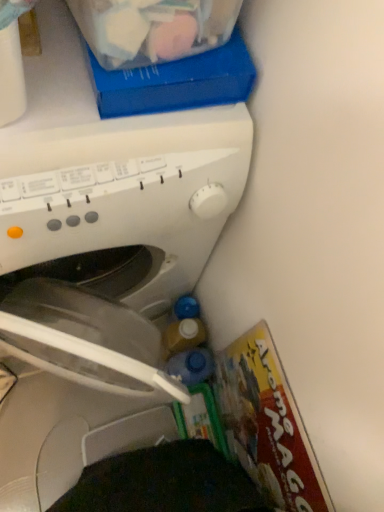
Describe the element at coordinates (115, 234) in the screenshot. I see `white plastic washing machine at center` at that location.

Where is `blue translucent bottle at lower right`? The image size is (384, 512). blue translucent bottle at lower right is located at coordinates (191, 366).

Find the location of a particular element. translucent plastic storage box at upper center is located at coordinates (175, 81).

Where is `washing machine on the left of blue translucent bottle at lower right`? washing machine on the left of blue translucent bottle at lower right is located at coordinates (115, 234).

Which of these two, blue translucent bottle at lower right or white plastic washing machine at center, is thinner?

Thinner between the two is blue translucent bottle at lower right.

Between blue translucent bottle at lower right and white plastic washing machine at center, which one appears on the right side from the viewer's perspective?

From the viewer's perspective, blue translucent bottle at lower right appears more on the right side.

Could white plastic washing machine at center be considered to be inside blue translucent bottle at lower right?

Actually, white plastic washing machine at center is outside blue translucent bottle at lower right.

Locate an element on the screen. washing machine below the translucent plastic storage box at upper center (from a real-world perspective) is located at coordinates (115, 234).

Does white plastic washing machine at center have a smaller size compared to translucent plastic storage box at upper center?

Incorrect, white plastic washing machine at center is not smaller in size than translucent plastic storage box at upper center.

From a real-world perspective, is white plastic washing machine at center above or below translucent plastic storage box at upper center?

Clearly, from a real-world perspective, white plastic washing machine at center is below translucent plastic storage box at upper center.

Which object is wider, white plastic washing machine at center or translucent plastic storage box at upper center?

white plastic washing machine at center is wider.

Is translucent plastic storage box at upper center looking in the opposite direction of matte cardboard magazine at lower right?

No, matte cardboard magazine at lower right is not at the back of translucent plastic storage box at upper center.

Is point (157, 95) positioned after point (304, 440)?

No, (157, 95) is closer to viewer.

The height and width of the screenshot is (512, 384). In order to click on magazine that is below the blue translucent bottle at lower right (from the image's perspective) in this screenshot , I will do `click(267, 424)`.

From a real-world perspective, does matte cardboard magazine at lower right sit lower than blue translucent bottle at lower right?

Incorrect, from a real-world perspective, matte cardboard magazine at lower right is higher than blue translucent bottle at lower right.

Measure the distance between matte cardboard magazine at lower right and blue translucent bottle at lower right.

matte cardboard magazine at lower right is 11.76 inches from blue translucent bottle at lower right.

Who is taller, matte cardboard magazine at lower right or blue translucent bottle at lower right?

matte cardboard magazine at lower right.

Is blue translucent bottle at lower right located outside matte cardboard magazine at lower right?

blue translucent bottle at lower right lies outside matte cardboard magazine at lower right's area.

Are blue translucent bottle at lower right and matte cardboard magazine at lower right beside each other?

No, blue translucent bottle at lower right is not making contact with matte cardboard magazine at lower right.

Between point (168, 360) and point (225, 370), which one is positioned in front?

The point (225, 370) is in front.

Is white plastic washing machine at center facing towards matte cardboard magazine at lower right?

Yes, white plastic washing machine at center is oriented towards matte cardboard magazine at lower right.

Is white plastic washing machine at center to the left of matte cardboard magazine at lower right from the viewer's perspective?

Indeed, white plastic washing machine at center is positioned on the left side of matte cardboard magazine at lower right.

Consider the image. From a real-world perspective, is white plastic washing machine at center below matte cardboard magazine at lower right?

Actually, white plastic washing machine at center is physically above matte cardboard magazine at lower right in the real world.

How distant is white plastic washing machine at center from matte cardboard magazine at lower right?

white plastic washing machine at center and matte cardboard magazine at lower right are 10.82 inches apart.

Is matte cardboard magazine at lower right located outside white plastic washing machine at center?

Yes, matte cardboard magazine at lower right is not within white plastic washing machine at center.

From the image's perspective, who appears lower, matte cardboard magazine at lower right or white plastic washing machine at center?

matte cardboard magazine at lower right.

From a real-world perspective, which is physically below, matte cardboard magazine at lower right or white plastic washing machine at center?

matte cardboard magazine at lower right.

Find the location of a particular element. washing machine that is in front of the blue translucent bottle at lower right is located at coordinates (115, 234).

The height and width of the screenshot is (512, 384). I want to click on storage box behind the white plastic washing machine at center, so click(175, 81).

Based on their spatial positions, is translucent plastic storage box at upper center or white plastic washing machine at center closer to matte cardboard magazine at lower right?

white plastic washing machine at center is closer to matte cardboard magazine at lower right.

Estimate the real-world distances between objects in this image. Which object is further from matte cardboard magazine at lower right, white plastic washing machine at center or translucent plastic storage box at upper center?

translucent plastic storage box at upper center is positioned further to the anchor matte cardboard magazine at lower right.

Looking at this image, considering their positions, is white plastic washing machine at center positioned closer to blue translucent bottle at lower right than translucent plastic storage box at upper center?

white plastic washing machine at center lies closer to blue translucent bottle at lower right than the other object.

Considering their positions, is translucent plastic storage box at upper center positioned closer to matte cardboard magazine at lower right than blue translucent bottle at lower right?

Among the two, blue translucent bottle at lower right is located nearer to matte cardboard magazine at lower right.

When comparing their distances from blue translucent bottle at lower right, does translucent plastic storage box at upper center or matte cardboard magazine at lower right seem further?

translucent plastic storage box at upper center is further to blue translucent bottle at lower right.

Consider the image. Considering their positions, is translucent plastic storage box at upper center positioned further to white plastic washing machine at center than matte cardboard magazine at lower right?

translucent plastic storage box at upper center lies further to white plastic washing machine at center than the other object.

When comparing their distances from translucent plastic storage box at upper center, does matte cardboard magazine at lower right or white plastic washing machine at center seem closer?

white plastic washing machine at center is positioned closer to the anchor translucent plastic storage box at upper center.

Looking at the image, which one is located further to blue translucent bottle at lower right, translucent plastic storage box at upper center or white plastic washing machine at center?

Based on the image, translucent plastic storage box at upper center appears to be further to blue translucent bottle at lower right.

Find the location of `magazine between white plastic washing machine at center and blue translucent bottle at lower right from front to back`. magazine between white plastic washing machine at center and blue translucent bottle at lower right from front to back is located at coordinates (267, 424).

The width and height of the screenshot is (384, 512). What are the coordinates of `washing machine between translucent plastic storage box at upper center and matte cardboard magazine at lower right from top to bottom` in the screenshot? It's located at (115, 234).

At what (x,y) coordinates should I click in order to perform the action: click on bottle between translucent plastic storage box at upper center and matte cardboard magazine at lower right vertically. Please return your answer as a coordinate pair (x, y). The width and height of the screenshot is (384, 512). Looking at the image, I should click on (191, 366).

You are a GUI agent. You are given a task and a screenshot of the screen. Output one action in this format:
    pyautogui.click(x=<x>, y=<y>)
    Task: Click on the washing machine between translucent plastic storage box at upper center and blue translucent bottle at lower right vertically
    This screenshot has height=512, width=384.
    Given the screenshot: What is the action you would take?
    pyautogui.click(x=115, y=234)